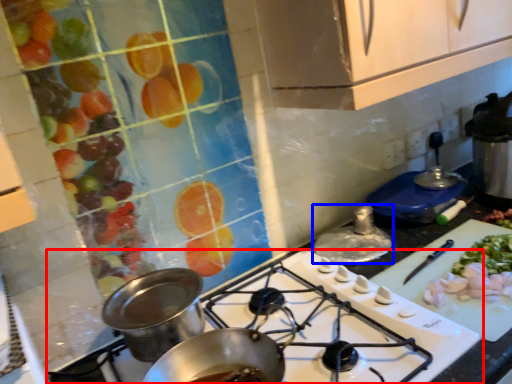
Question: Which of the following is the closest to the observer, gas stove (highlighted by a red box) or kitchen appliance (highlighted by a blue box)?

Choices:
 (A) gas stove
 (B) kitchen appliance

Answer: (A)